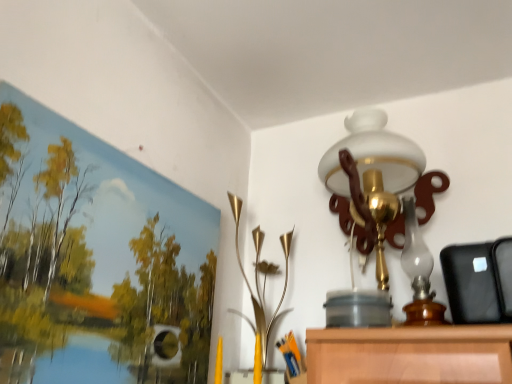
Question: Is matte canvas landscape at upper left touching gold metallic vase at center, the second lamp viewed from the right?

Choices:
 (A) yes
 (B) no

Answer: (B)

Question: From the image's perspective, is matte canvas landscape at upper left under gold metallic vase at center, which is the first lamp from left to right?

Choices:
 (A) yes
 (B) no

Answer: (B)

Question: Can you confirm if matte canvas landscape at upper left is positioned to the right of gold metallic vase at center, the second lamp viewed from the right?

Choices:
 (A) yes
 (B) no

Answer: (B)

Question: Is matte canvas landscape at upper left not close to gold metallic vase at center, which is the first lamp from left to right?

Choices:
 (A) no
 (B) yes

Answer: (A)

Question: Does matte canvas landscape at upper left have a smaller size compared to gold metallic vase at center, which is the first lamp from left to right?

Choices:
 (A) no
 (B) yes

Answer: (B)

Question: Could you tell me if matte canvas landscape at upper left is facing gold metallic vase at center, which is the first lamp from left to right?

Choices:
 (A) yes
 (B) no

Answer: (B)

Question: Is white glass lamp at upper center, the first lamp from the right, at the left side of matte canvas landscape at upper left?

Choices:
 (A) yes
 (B) no

Answer: (B)

Question: Does white glass lamp at upper center, the first lamp from the right, have a larger size compared to matte canvas landscape at upper left?

Choices:
 (A) yes
 (B) no

Answer: (A)

Question: Is white glass lamp at upper center, the first lamp from the right, further to camera compared to matte canvas landscape at upper left?

Choices:
 (A) yes
 (B) no

Answer: (A)

Question: Can you confirm if white glass lamp at upper center, the first lamp from the right, is smaller than matte canvas landscape at upper left?

Choices:
 (A) yes
 (B) no

Answer: (B)

Question: Is white glass lamp at upper center, positioned as the second lamp in left-to-right order, in contact with matte canvas landscape at upper left?

Choices:
 (A) no
 (B) yes

Answer: (A)

Question: Can you confirm if white glass lamp at upper center, the first lamp from the right, is shorter than matte canvas landscape at upper left?

Choices:
 (A) yes
 (B) no

Answer: (B)

Question: Is white glass lamp at upper center, positioned as the second lamp in left-to-right order, positioned with its back to gold metallic vase at center, the second lamp viewed from the right?

Choices:
 (A) no
 (B) yes

Answer: (A)